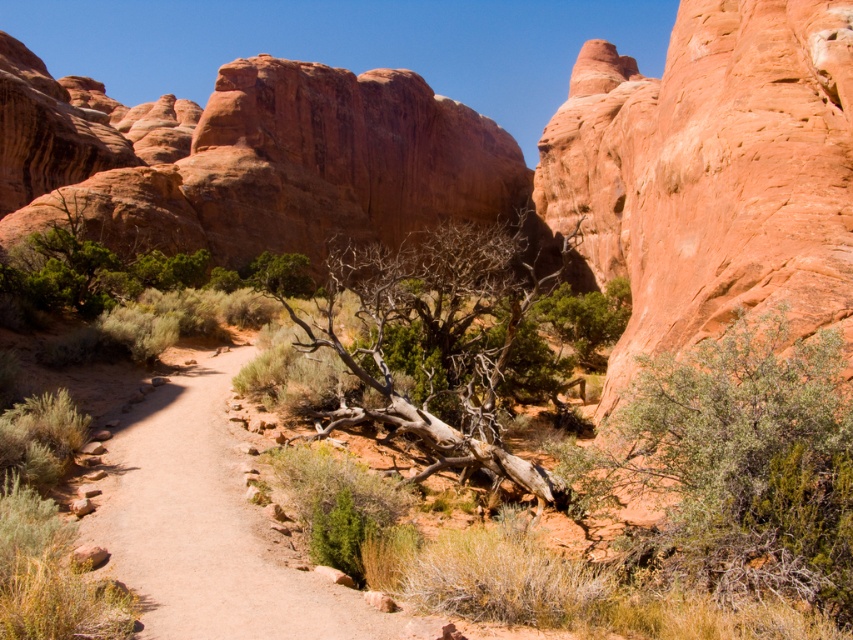
You are a hiker who needs to cross the brown dirt path at center and the dead wood at center. Which one is farther away from you?

The distance between the brown dirt path at center and the dead wood at center is 37.72 meters, so the dead wood at center is farther away from you than the brown dirt path at center.